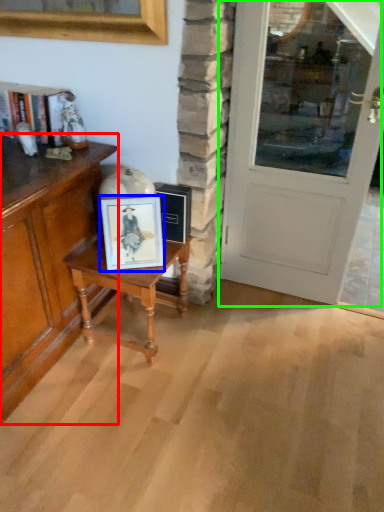
Question: Which object is the closest to the cabinetry (highlighted by a red box)? Choose among these: picture frame (highlighted by a blue box) or door (highlighted by a green box).

Choices:
 (A) picture frame
 (B) door

Answer: (A)